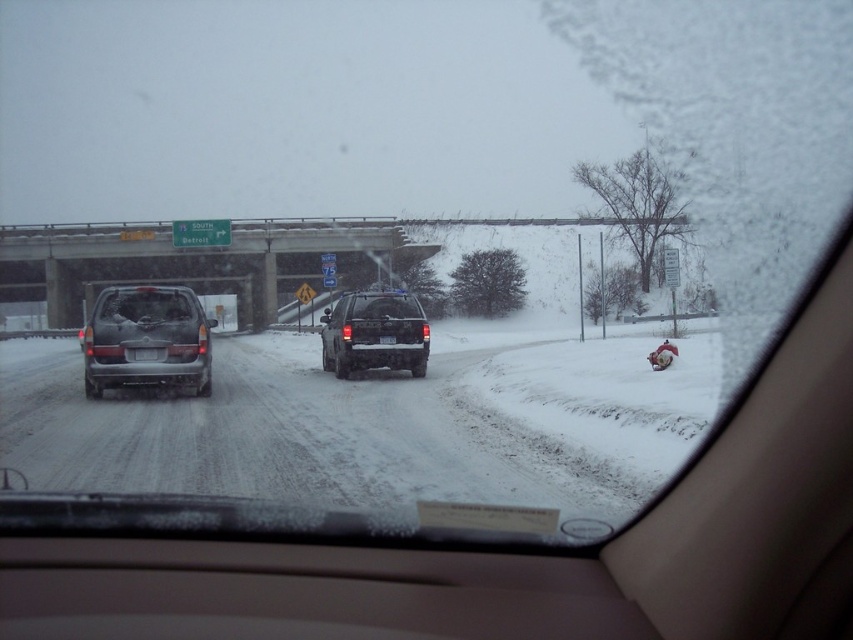
Question: Is satin black suv at center to the left of black plastic license plate at rear from the viewer's perspective?

Choices:
 (A) no
 (B) yes

Answer: (A)

Question: Can you confirm if black plastic license plate at rear is positioned to the right of black plastic license plate at center?

Choices:
 (A) no
 (B) yes

Answer: (A)

Question: In this image, where is black plastic license plate at rear located relative to black plastic license plate at center?

Choices:
 (A) right
 (B) left

Answer: (B)

Question: Which object appears closest to the camera in this image?

Choices:
 (A) black plastic license plate at center
 (B) black plastic license plate at rear
 (C) smokey gray suv at left
 (D) concrete bridge at center

Answer: (C)

Question: Which point appears closest to the camera in this image?

Choices:
 (A) (169, 356)
 (B) (355, 353)
 (C) (325, 236)
 (D) (138, 353)

Answer: (D)

Question: Among these points, which one is farthest from the camera?

Choices:
 (A) (393, 337)
 (B) (375, 266)

Answer: (B)